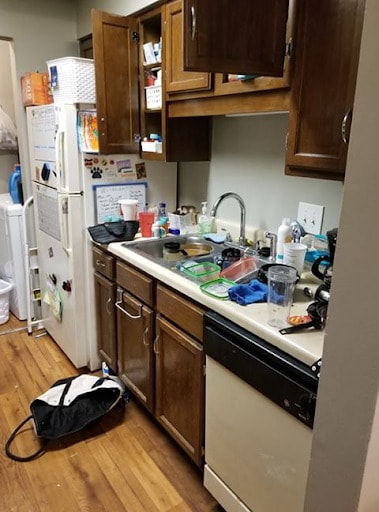
At what (x,y) coordinates should I click in order to perform the action: click on diswasher. Please return your answer as a coordinate pair (x, y). This screenshot has width=379, height=512. Looking at the image, I should click on (264, 458).